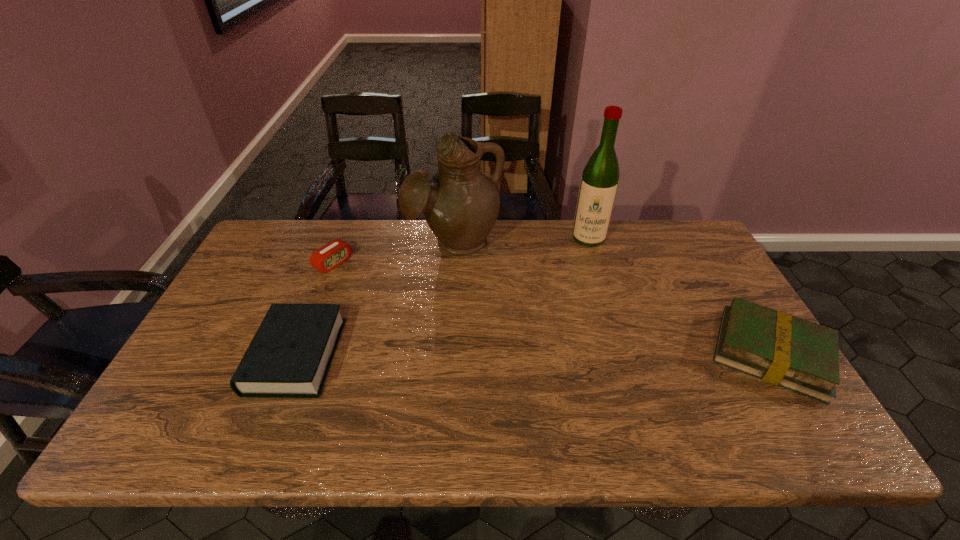
Identify the location of vacant area that satisfies the following two spatial constraints: 1. on the front side of the book; 2. on the left side of the liquor. (623, 354).